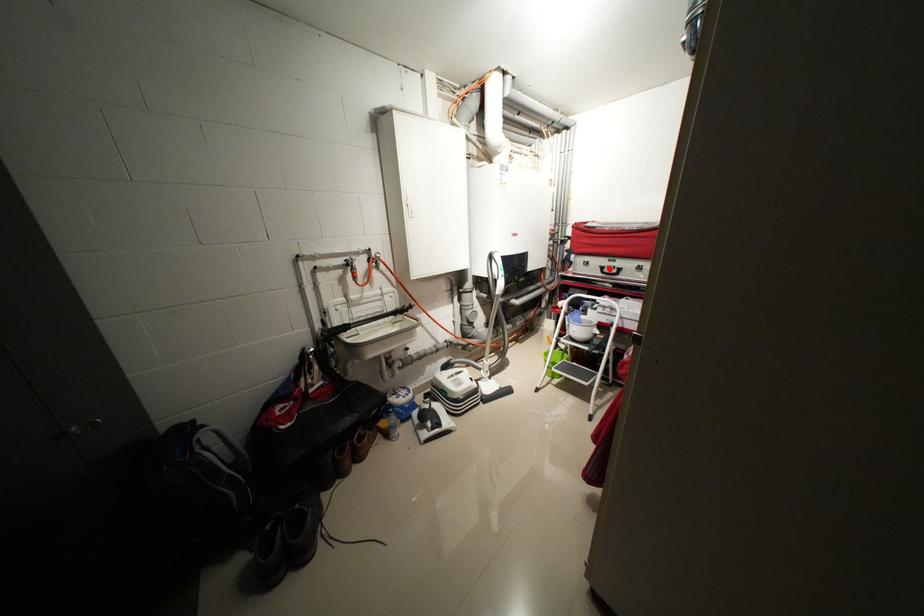
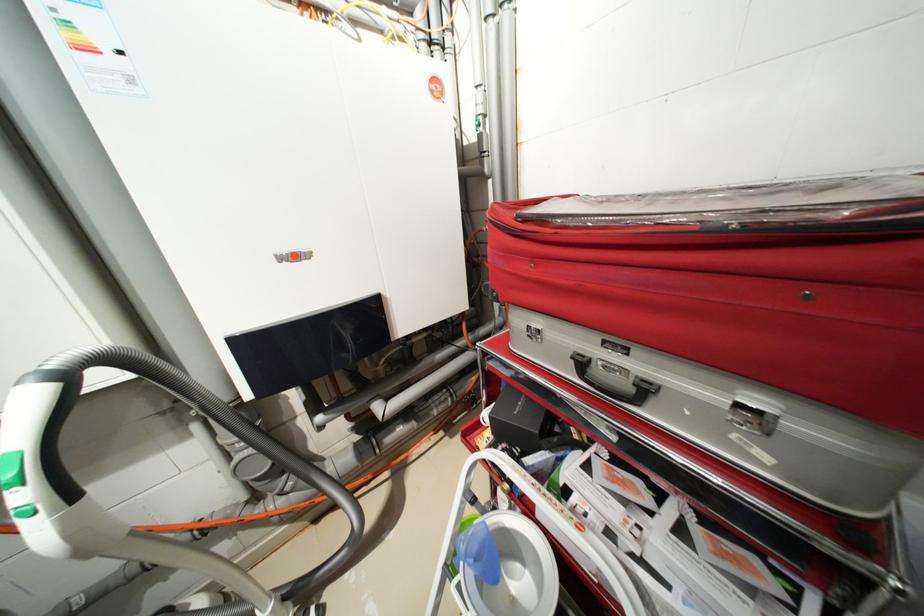
Question: I am providing you with two images of the same scene from different viewpoints. A red point is shown in image1. For the corresponding object point in image2, is it positioned nearer or farther from the camera?

Choices:
 (A) Nearer
 (B) Farther

Answer: (B)